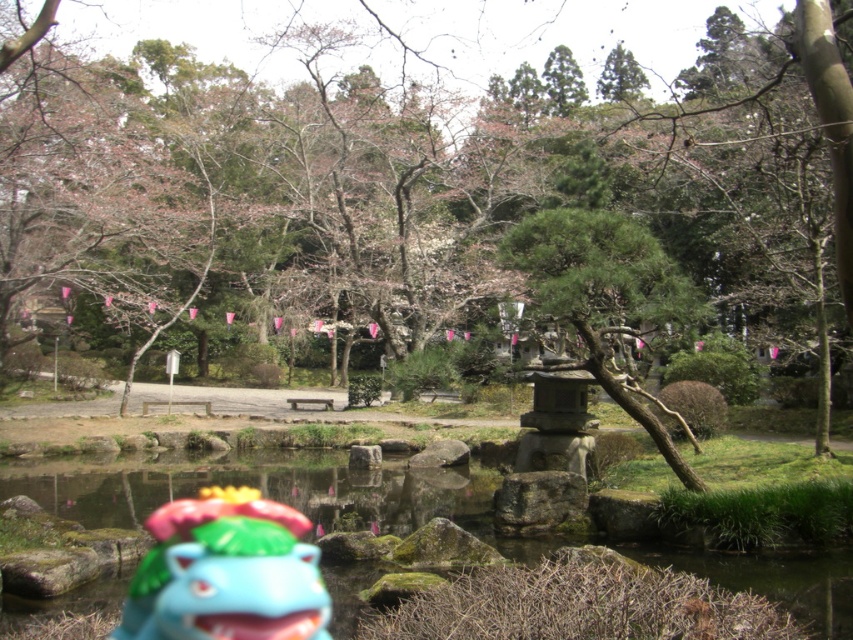
You are a visitor in the Japanese garden and see the green mossy rocks at center and the shiny plastic toy at lower center. Which object is closer to the water surface?

The green mossy rocks at center is located below the shiny plastic toy at lower center, so it is closer to the water surface.

You are a gardener who wants to place a new decorative item in the Japanese garden. You have a small statue that is 10 cm wide. The shiny plastic toy at lower center is currently in the garden. Can the green mossy rocks at center accommodate the statue without overlapping?

The green mossy rocks at center are wider than the shiny plastic toy at lower center. Since the statue is 10 cm wide and the mossy rocks are larger, there should be enough space to place the statue there without overlapping.